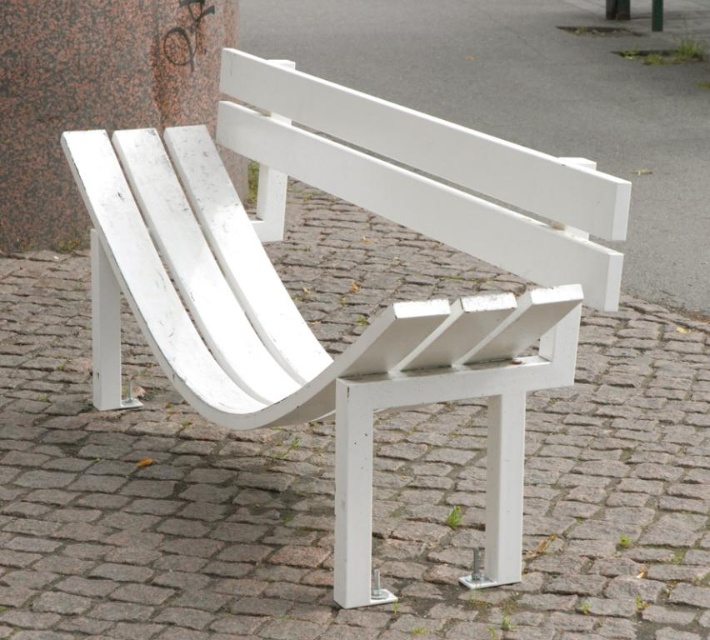
At what (x,y) coordinates should I click in order to perform the action: click on white painted wood bench at center. Please return your answer as a coordinate pair (x, y). The height and width of the screenshot is (640, 710). Looking at the image, I should click on (378, 314).

Locate an element on the screen. The image size is (710, 640). white painted wood bench at center is located at coordinates (378, 314).